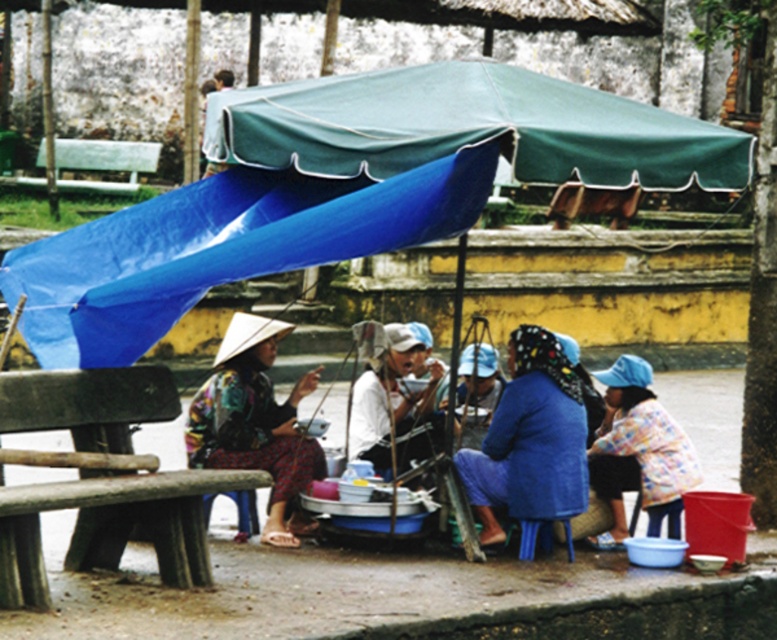
You are standing in the market scene and want to locate the green fabric canopy at upper center. What are the coordinates where you should look?

The green fabric canopy at upper center is located at coordinates point (471, 129).

You are standing at the center of the scene and want to place a small potted plant between the plaid fabric shirt at lower right and the white wooden bench at left. Which object should you place the plant closer to so that it is closer to the taller object?

The plaid fabric shirt at lower right is much taller than the white wooden bench at left, so you should place the plant closer to the plaid fabric shirt at lower right to ensure it is near the taller object.